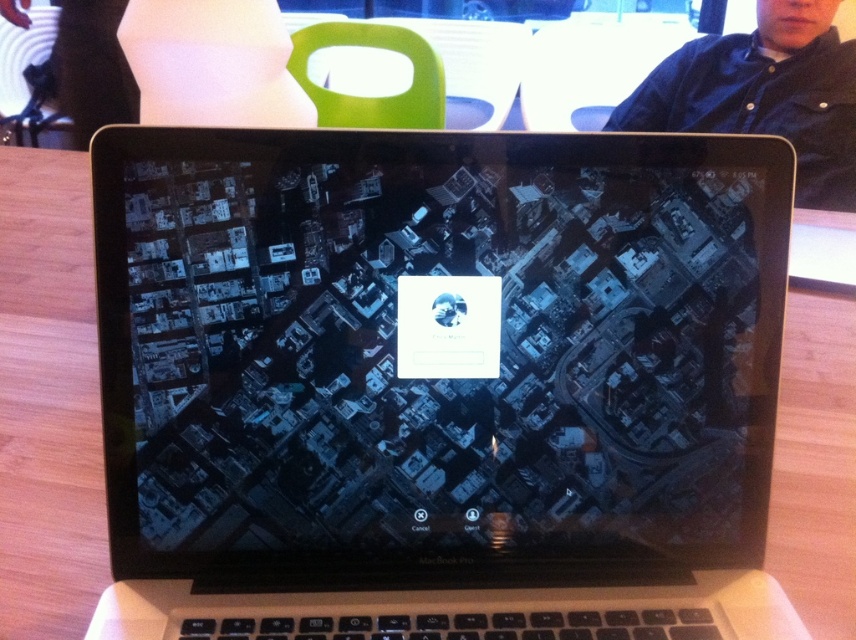
Question: Does sleek silver laptop at center have a larger size compared to dark blue shirt at upper right?

Choices:
 (A) yes
 (B) no

Answer: (B)

Question: Which of the following is the farthest from the observer?

Choices:
 (A) (811, 168)
 (B) (712, 582)

Answer: (A)

Question: Is sleek silver laptop at center closer to camera compared to dark blue shirt at upper right?

Choices:
 (A) no
 (B) yes

Answer: (B)

Question: Does sleek silver laptop at center have a greater width compared to dark blue shirt at upper right?

Choices:
 (A) yes
 (B) no

Answer: (B)

Question: Which of the following is the farthest from the observer?

Choices:
 (A) (774, 68)
 (B) (486, 541)

Answer: (A)